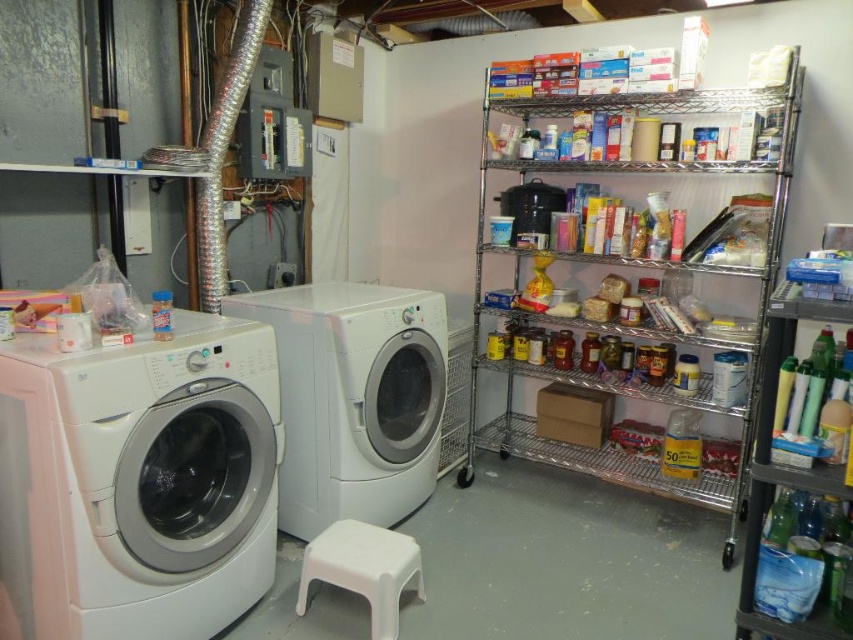
Does metallic wire shelving at right appear over white glossy washing machine at left?

Correct, metallic wire shelving at right is located above white glossy washing machine at left.

Measure the distance between metallic wire shelving at right and camera.

2.30 meters

Where is `metallic wire shelving at right`? Image resolution: width=853 pixels, height=640 pixels. metallic wire shelving at right is located at coordinates (637, 276).

In the scene shown: Between white glossy washing machine at left and white plastic stool at lower center, which one has less height?

white plastic stool at lower center is shorter.

You are a GUI agent. You are given a task and a screenshot of the screen. Output one action in this format:
    pyautogui.click(x=<x>, y=<y>)
    Task: Click on the white glossy washing machine at left
    
    Given the screenshot: What is the action you would take?
    pyautogui.click(x=138, y=481)

Is white glossy washing machine at left to the right of white glossy washing machine at center from the viewer's perspective?

No, white glossy washing machine at left is not to the right of white glossy washing machine at center.

Does white glossy washing machine at left appear on the left side of white glossy washing machine at center?

Correct, you'll find white glossy washing machine at left to the left of white glossy washing machine at center.

Who is more forward, (61, 515) or (437, 387)?

Positioned in front is point (61, 515).

This screenshot has height=640, width=853. In order to click on white glossy washing machine at left in this screenshot , I will do `click(138, 481)`.